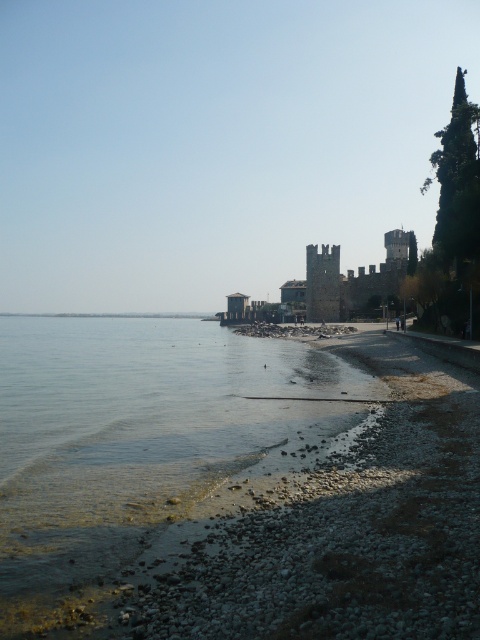
Question: Among these objects, which one is nearest to the camera?

Choices:
 (A) clear water at lower left
 (B) dark stone castle at center

Answer: (A)

Question: From the image, what is the correct spatial relationship of clear water at lower left in relation to dark stone castle at center?

Choices:
 (A) right
 (B) left

Answer: (B)

Question: Is clear water at lower left wider than dark stone castle at center?

Choices:
 (A) no
 (B) yes

Answer: (B)

Question: Is clear water at lower left closer to the viewer compared to dark stone castle at center?

Choices:
 (A) yes
 (B) no

Answer: (A)

Question: Which object is closer to the camera taking this photo?

Choices:
 (A) dark stone castle at center
 (B) clear water at lower left

Answer: (B)